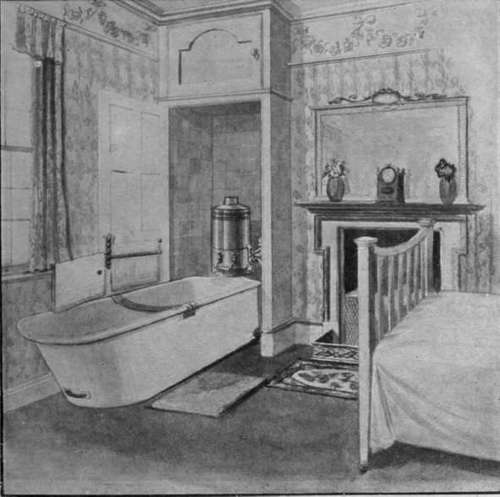
This screenshot has width=500, height=497. I want to click on door, so click(127, 130).